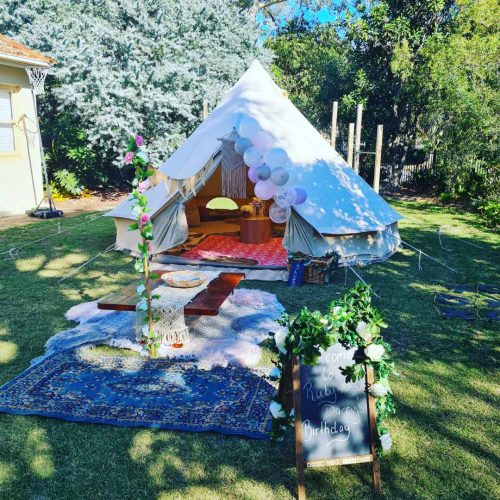
The height and width of the screenshot is (500, 500). Find the location of `inside of tent`. inside of tent is located at coordinates (249, 187).